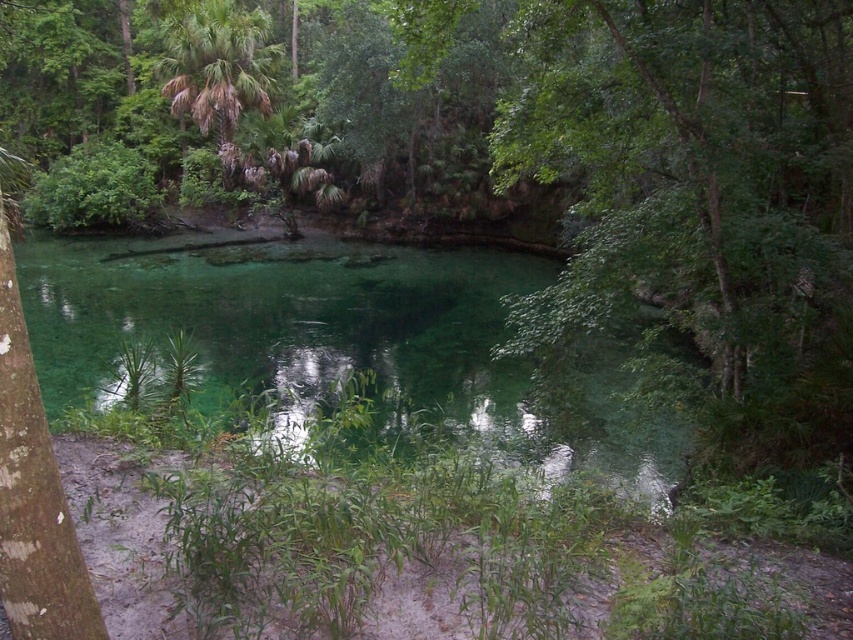
Between green translucent water at center and green leafy palm tree at upper left, which one appears on the left side from the viewer's perspective?

From the viewer's perspective, green leafy palm tree at upper left appears more on the left side.

Who is positioned more to the right, green translucent water at center or green leafy palm tree at upper left?

Positioned to the right is green translucent water at center.

The width and height of the screenshot is (853, 640). I want to click on green translucent water at center, so click(x=322, y=337).

In order to click on green translucent water at center in this screenshot , I will do (x=322, y=337).